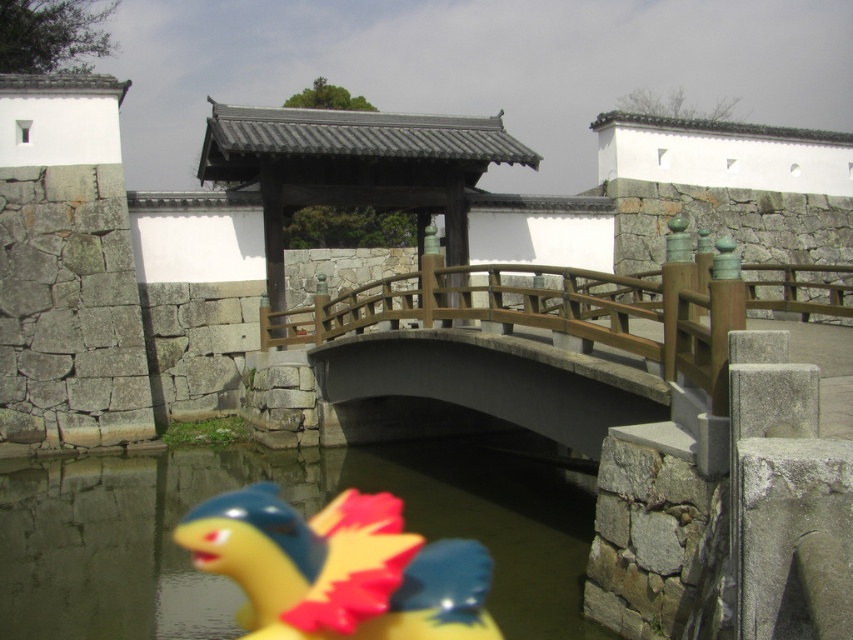
Question: Which point is farther to the camera?

Choices:
 (A) wooden bridge at center
 (B) brown wooden gazebo at center

Answer: (B)

Question: Which of the following is the farthest from the observer?

Choices:
 (A) (689, 328)
 (B) (97, 634)

Answer: (B)

Question: Observing the image, what is the correct spatial positioning of yellow rubber duck at lower center in reference to brown wooden gazebo at center?

Choices:
 (A) right
 (B) left

Answer: (A)

Question: Is wooden bridge at center positioned behind yellow rubber duck at lower center?

Choices:
 (A) yes
 (B) no

Answer: (B)

Question: Based on their relative distances, which object is farther from the yellow rubber duck at lower center?

Choices:
 (A) brown wooden gazebo at center
 (B) wooden bridge at center

Answer: (A)

Question: Where is wooden bridge at center located in relation to yellow rubber duck at lower center in the image?

Choices:
 (A) below
 (B) above

Answer: (B)